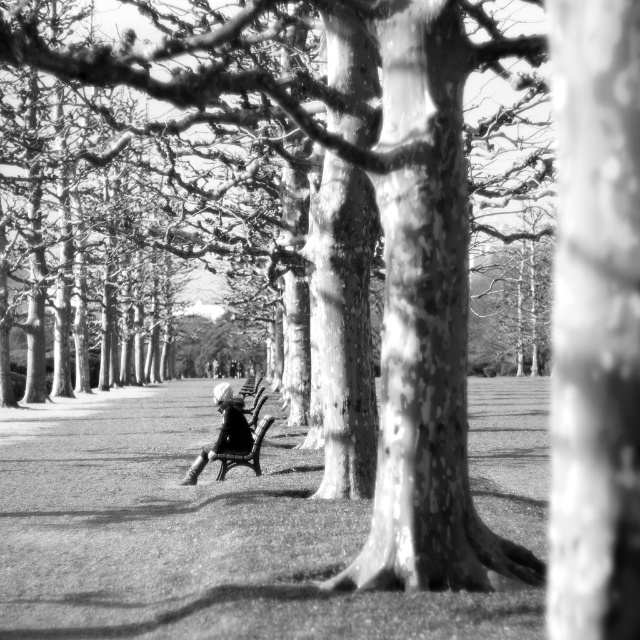
Question: Does white fabric jacket at center appear on the left side of black wood bench at center?

Choices:
 (A) no
 (B) yes

Answer: (B)

Question: Which object is closer to the camera taking this photo?

Choices:
 (A) white fabric jacket at center
 (B) black wood bench at center

Answer: (A)

Question: Is white fabric jacket at center bigger than black wood bench at center?

Choices:
 (A) no
 (B) yes

Answer: (B)

Question: Which point is farther to the camera?

Choices:
 (A) black wood bench at center
 (B) white fabric jacket at center

Answer: (A)

Question: Among these objects, which one is farthest from the camera?

Choices:
 (A) black wood bench at center
 (B) white fabric jacket at center

Answer: (A)

Question: Is white fabric jacket at center positioned at the back of black wood bench at center?

Choices:
 (A) no
 (B) yes

Answer: (A)